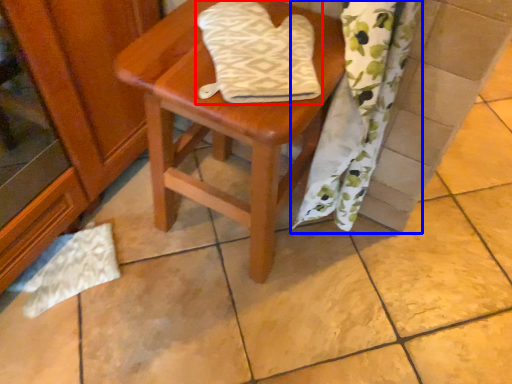
Question: Which object appears farthest to the camera in this image, beach towel (highlighted by a red box) or curtain (highlighted by a blue box)?

Choices:
 (A) beach towel
 (B) curtain

Answer: (A)